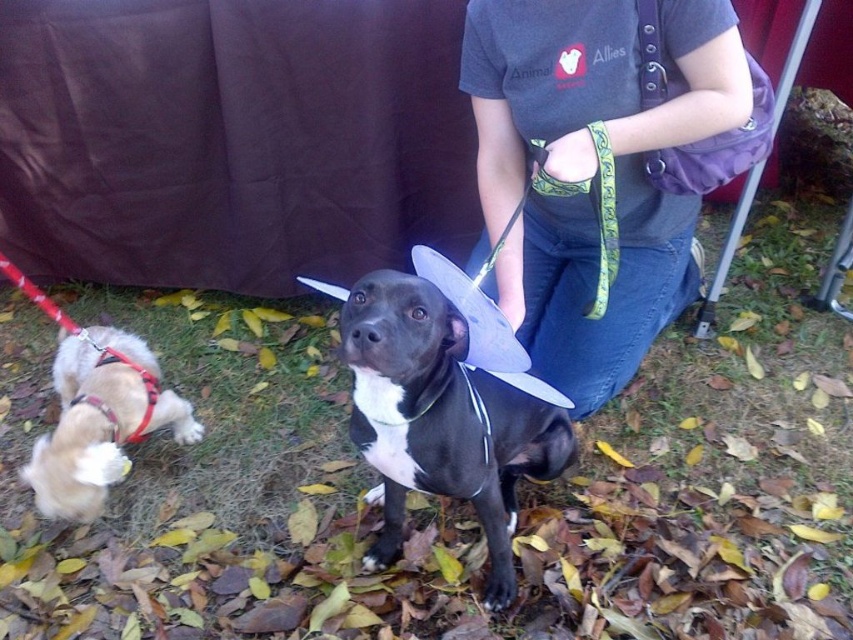
Is point (480, 237) closer to viewer compared to point (152, 394)?

No, (480, 237) is further to viewer.

Is denim jeans at center to the right of red nylon leash at lower left from the viewer's perspective?

Indeed, denim jeans at center is positioned on the right side of red nylon leash at lower left.

What are the coordinates of `denim jeans at center` in the screenshot? It's located at (590, 172).

Between black matte dog at center and red nylon leash at lower left, which one is positioned higher?

red nylon leash at lower left is higher up.

Is black matte dog at center below red nylon leash at lower left?

Correct, black matte dog at center is located below red nylon leash at lower left.

Is point (401, 470) positioned after point (144, 381)?

No, (401, 470) is in front of (144, 381).

Where is `black matte dog at center`? This screenshot has height=640, width=853. black matte dog at center is located at coordinates (440, 419).

Is black matte dog at center to the right of light brown fur at lower left from the viewer's perspective?

Correct, you'll find black matte dog at center to the right of light brown fur at lower left.

From the picture: Which is above, black matte dog at center or light brown fur at lower left?

Positioned higher is black matte dog at center.

Is point (445, 316) positioned behind point (115, 410)?

No, (445, 316) is closer to viewer.

Find the location of a particular element. black matte dog at center is located at coordinates (440, 419).